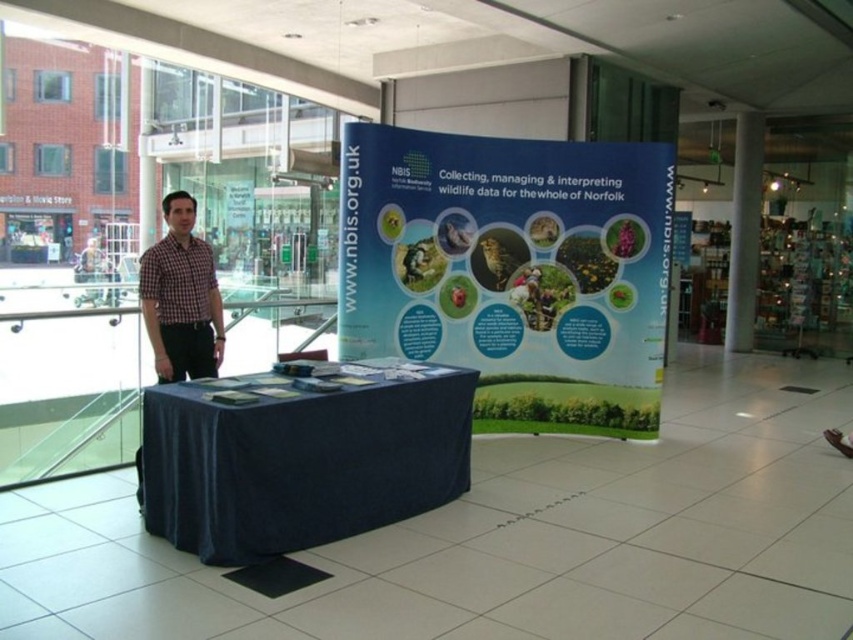
You are a visitor approaching the blue fabric table at center and the checkered fabric shirt at left. You need to reach both to pick up a brochure and ask a question. Which object should you approach first to minimize the distance you walk?

You should approach the blue fabric table at center first because it is closer to your starting position than the checkered fabric shirt at left, as they are 3.78 feet apart.

You are a visitor at the mall and want to read the blue fabric poster at center. You notice a man wearing a checkered fabric shirt at left standing near it. Is the poster wider than the man?

The blue fabric poster at center might be wider than checkered fabric shirt at left.

You are a visitor at the mall and see the blue fabric poster at center and the blue fabric table at center. Which one is positioned to the right side of the other?

The blue fabric poster at center is to the right of the blue fabric table at center.